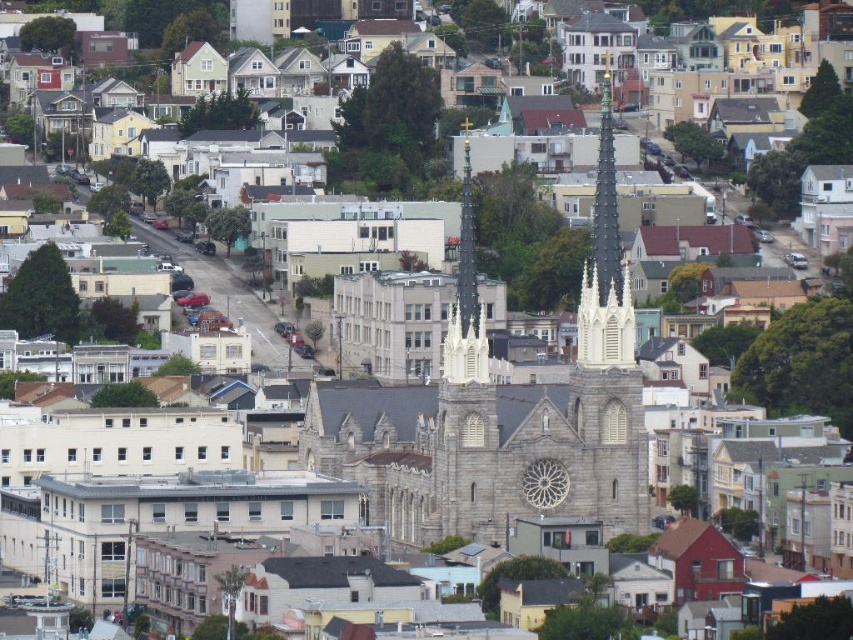
You are standing in the middle of the urban area and want to take a photo of the gray stone church spire at center. Considering your current position, can you estimate whether the spire is within the standard camera lens range of 100 feet?

The gray stone church spire at center is 1948.25 feet away from the viewer, which is far beyond the standard camera lens range of 100 feet. Therefore, the spire is not within the standard range.

You are standing in the urban area and want to take a photo of the gray stone church spire at center and the white stone spire at center. Which spire should you focus on first to ensure both are in the frame without moving the camera?

You should focus on the gray stone church spire at center first because it is closer to the viewer than the white stone spire at center, so keeping it in focus will also include the farther spire in the frame.